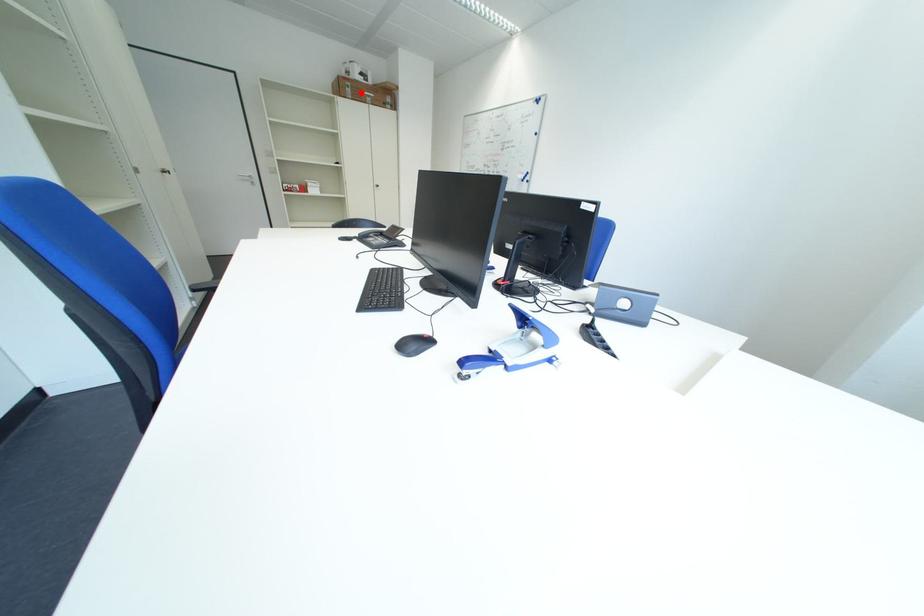
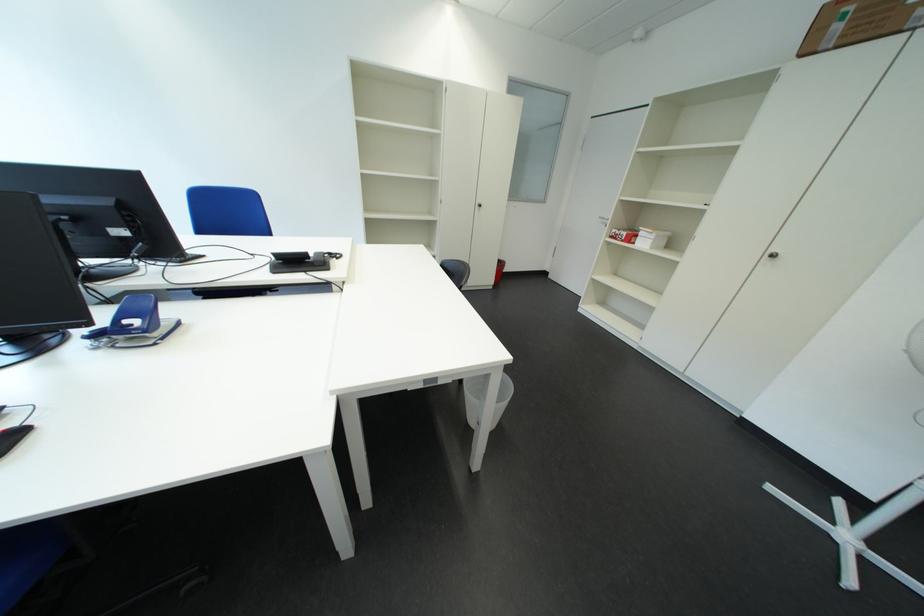
Question: A red point is marked in image1. In image2, is the corresponding 3D point closer to the camera or farther? Reply with the corresponding letter.

Choices:
 (A) The corresponding 3D point is closer.
 (B) The corresponding 3D point is farther.

Answer: (B)